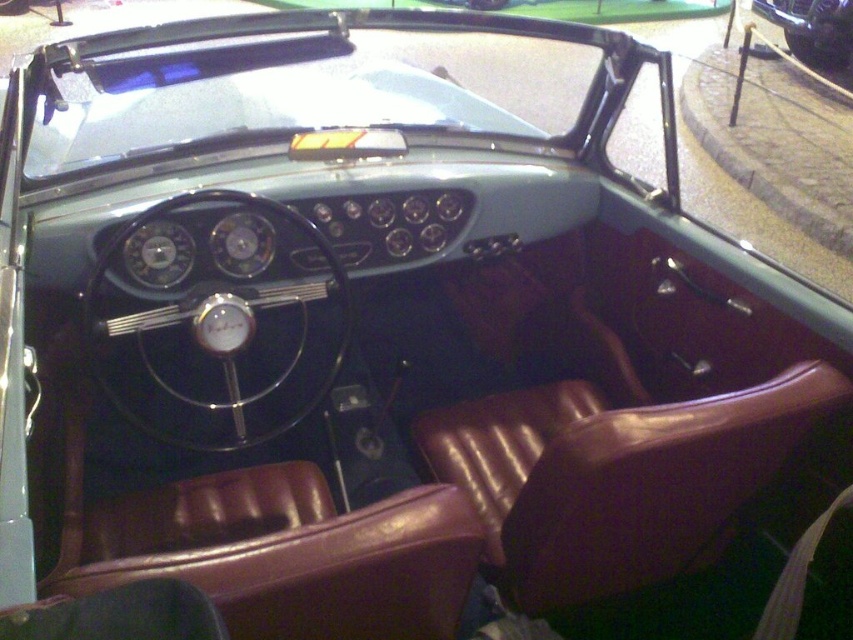
Who is taller, black leather steering wheel at center or shiny black car at upper right?

Standing taller between the two is shiny black car at upper right.

Is black leather steering wheel at center bigger than shiny black car at upper right?

No.

What do you see at coordinates (218, 323) in the screenshot? The image size is (853, 640). I see `black leather steering wheel at center` at bounding box center [218, 323].

Find the location of a particular element. black leather steering wheel at center is located at coordinates (218, 323).